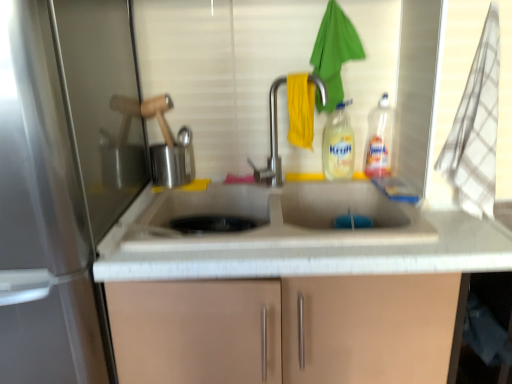
Question: Based on their positions, is translucent plastic bottle at upper right, positioned as the first bottle in right-to-left order, located to the left or right of satin nickel faucet at center?

Choices:
 (A) left
 (B) right

Answer: (B)

Question: Do you think translucent plastic bottle at upper right, marked as the second bottle in a left-to-right arrangement, is within satin nickel faucet at center, or outside of it?

Choices:
 (A) outside
 (B) inside

Answer: (A)

Question: Which is farther from the yellow translucent liquid at center, the second bottle positioned from the right?

Choices:
 (A) brushed metal kettle at upper left
 (B) brushed metal screen door at left
 (C) satin nickel faucet at center
 (D) translucent plastic bottle at upper right, positioned as the first bottle in right-to-left order

Answer: (B)

Question: Which is farther from the satin nickel faucet at center?

Choices:
 (A) translucent plastic bottle at upper right, marked as the second bottle in a left-to-right arrangement
 (B) brushed metal screen door at left
 (C) yellow translucent liquid at center, the 1th bottle positioned from the left
 (D) brushed metal kettle at upper left

Answer: (B)